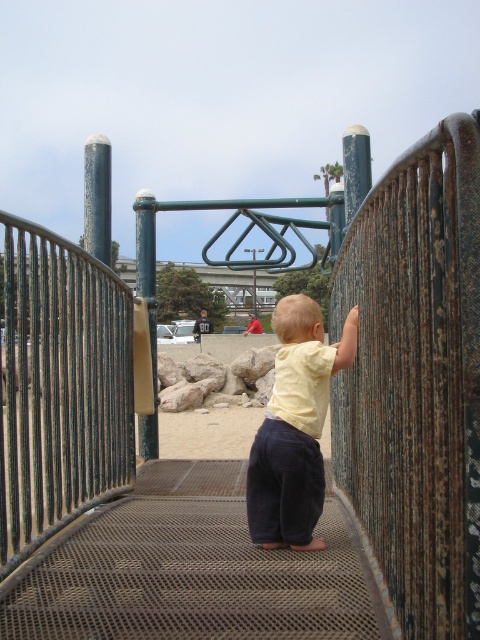
Is rustic metal stairs at center in front of yellow matte shirt at center?

Yes, rustic metal stairs at center is in front of yellow matte shirt at center.

Between rustic metal stairs at center and yellow matte shirt at center, which one appears on the left side from the viewer's perspective?

Positioned to the left is rustic metal stairs at center.

Does point (201, 518) come in front of point (287, 436)?

No, (201, 518) is behind (287, 436).

I want to click on rustic metal stairs at center, so click(x=191, y=570).